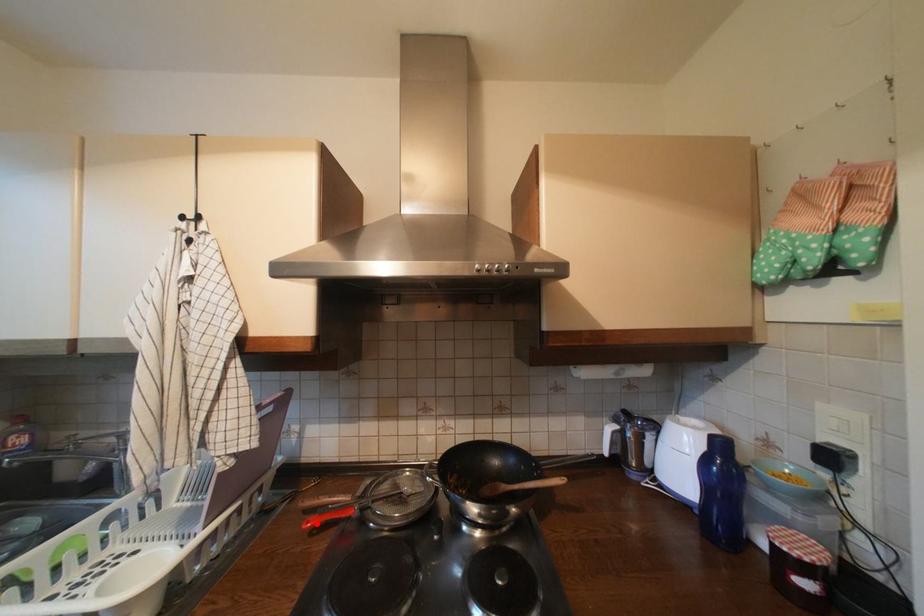
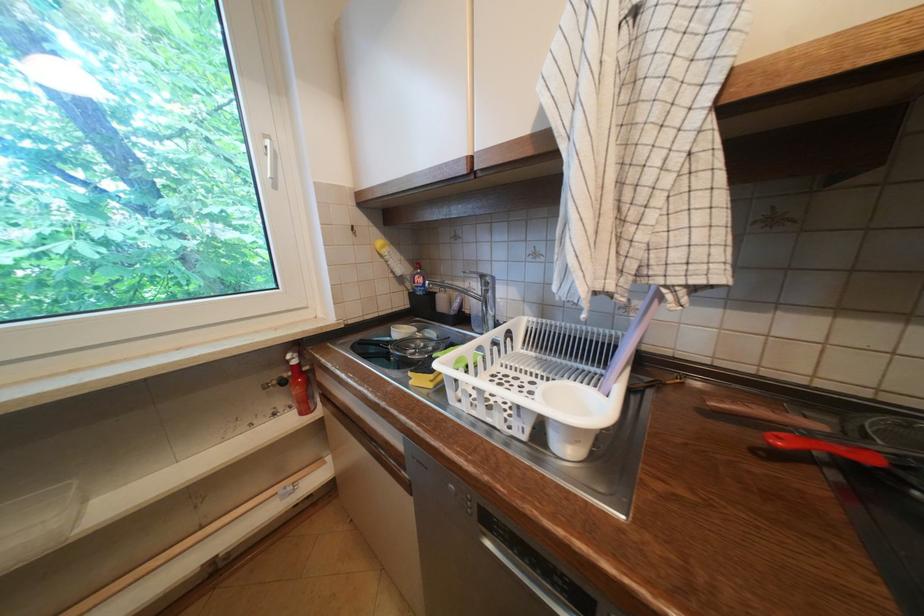
The point at the highlighted location is marked in the first image. Where is the corresponding point in the second image?

(788, 440)